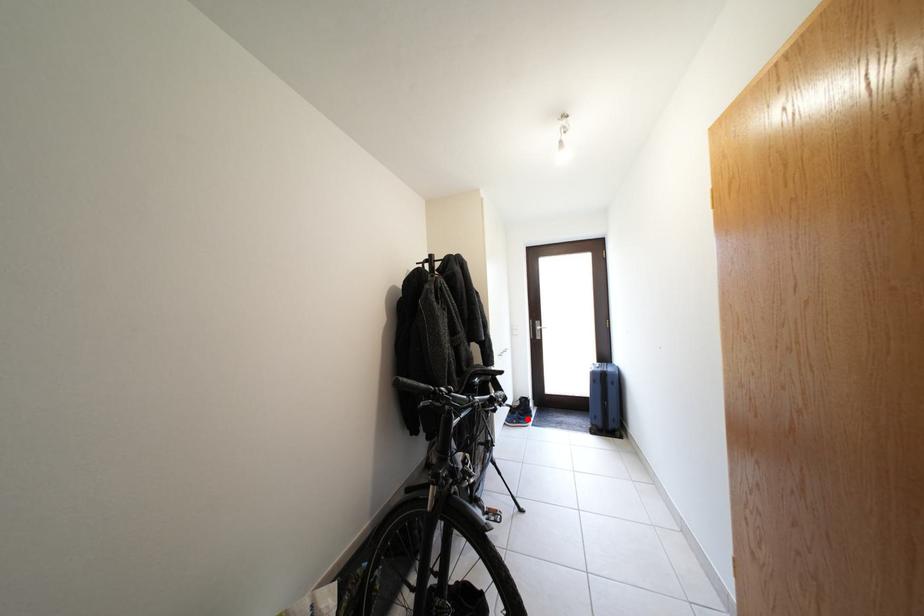
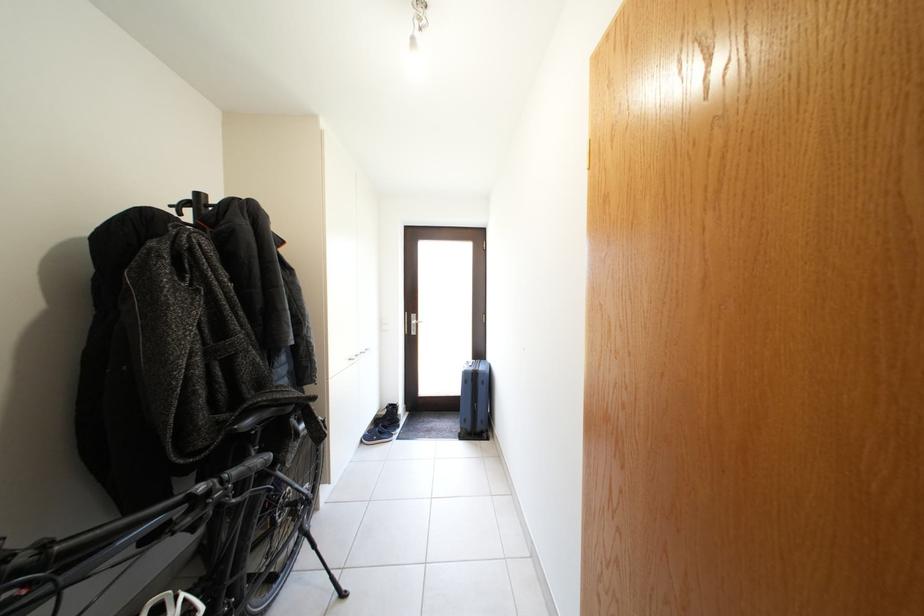
Question: A red point is marked in image1. In image2, is the corresponding 3D point closer to the camera or farther? Reply with the corresponding letter.

Choices:
 (A) The corresponding 3D point is closer.
 (B) The corresponding 3D point is farther.

Answer: (A)